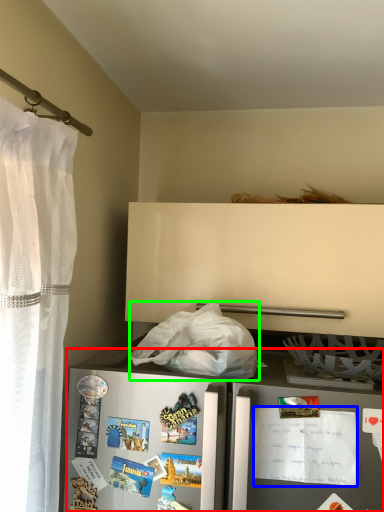
Question: Which object is positioned farthest from refrigerator (highlighted by a red box)? Select from postcard (highlighted by a blue box) and plastic bag (highlighted by a green box).

Choices:
 (A) postcard
 (B) plastic bag

Answer: (B)